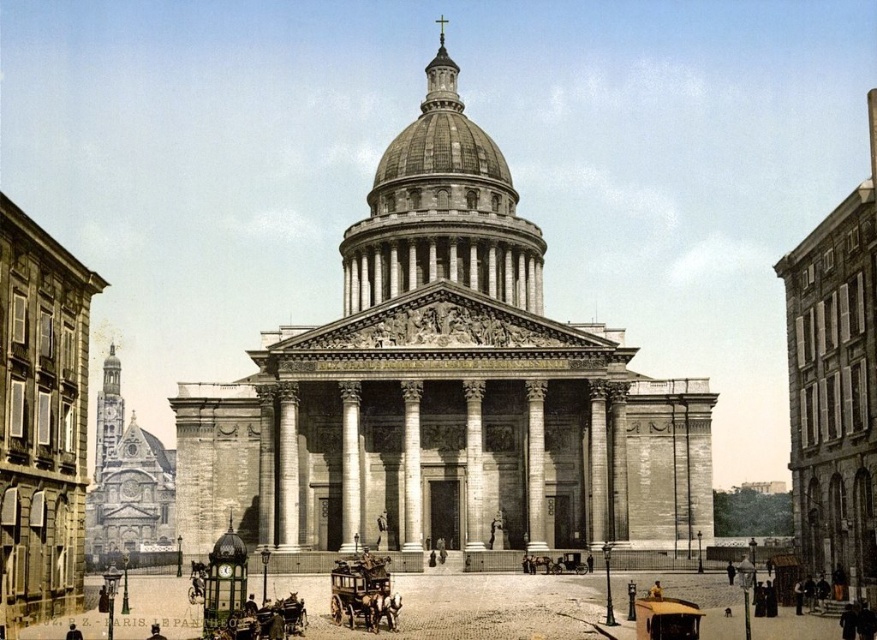
Is stone cathedral at center taller than wooden polished horse cart at center?

Yes, stone cathedral at center is taller than wooden polished horse cart at center.

Who is higher up, stone cathedral at center or wooden polished horse cart at center?

stone cathedral at center

Does point (404, 259) come behind point (375, 596)?

Yes.

In order to click on stone cathedral at center in this screenshot , I will do `click(443, 390)`.